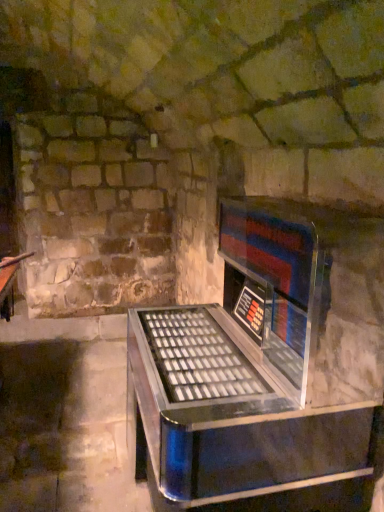
Image resolution: width=384 pixels, height=512 pixels. Identify the location of metallic/reflective jukebox at center. (265, 367).

The height and width of the screenshot is (512, 384). What do you see at coordinates (265, 367) in the screenshot?
I see `metallic/reflective jukebox at center` at bounding box center [265, 367].

The height and width of the screenshot is (512, 384). I want to click on metallic/reflective jukebox at center, so point(265,367).